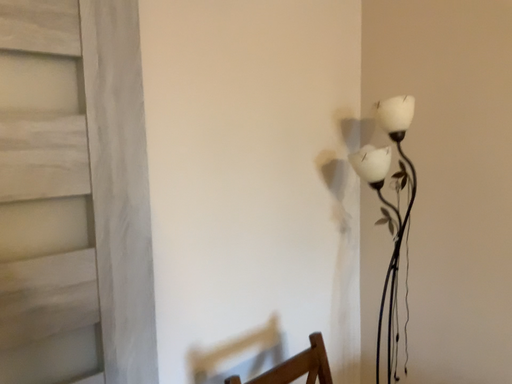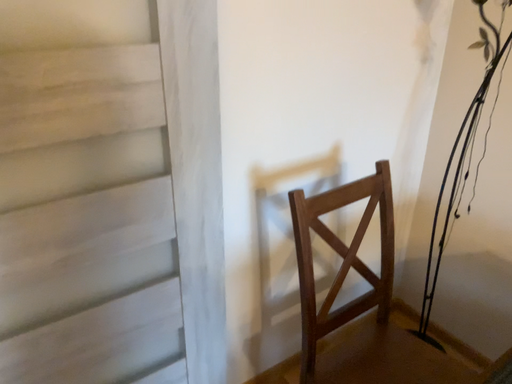
Question: How did the camera likely rotate when shooting the video?

Choices:
 (A) rotated downward
 (B) rotated upward

Answer: (A)